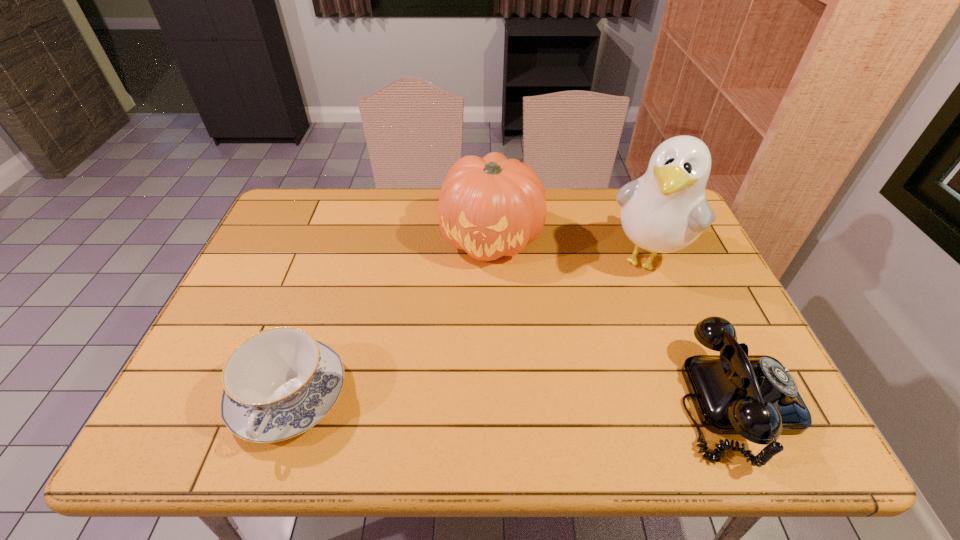
Where is `chinaware`? chinaware is located at coordinates pos(277,384).

Find the location of a particular element. the leftmost object is located at coordinates (277, 384).

You are a GUI agent. You are given a task and a screenshot of the screen. Output one action in this format:
    pyautogui.click(x=<x>, y=<y>)
    Task: Click on the telephone
    The height and width of the screenshot is (540, 960).
    Given the screenshot: What is the action you would take?
    pyautogui.click(x=755, y=396)

You are a GUI agent. You are given a task and a screenshot of the screen. Output one action in this format:
    pyautogui.click(x=<x>, y=<y>)
    Task: Click on the second object from left to right
    Image resolution: width=960 pixels, height=540 pixels.
    Given the screenshot: What is the action you would take?
    pyautogui.click(x=490, y=207)

Identify the location of the second tallest object. (490, 207).

At what (x,y) coordinates should I click in order to perform the action: click on the tallest object. Please return your answer as a coordinate pair (x, y). Image resolution: width=960 pixels, height=540 pixels. Looking at the image, I should click on (665, 210).

Locate an element on the screen. vacant space situated on the carved face of the second object from left to right is located at coordinates (485, 291).

I want to click on free location located on the carved face of the second object from left to right, so click(x=478, y=338).

Where is `vacant point located 0.260m on the carved face of the second object from left to right`? Image resolution: width=960 pixels, height=540 pixels. vacant point located 0.260m on the carved face of the second object from left to right is located at coordinates (476, 351).

The width and height of the screenshot is (960, 540). I want to click on free space located 0.370m on the beak of the gull, so click(x=575, y=387).